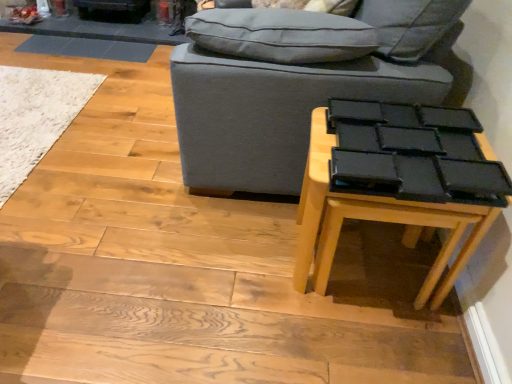
Question: From a real-world perspective, is white shaggy rug at lower left positioned under gray fabric studio couch at center based on gravity?

Choices:
 (A) no
 (B) yes

Answer: (B)

Question: Is white shaggy rug at lower left placed right next to gray fabric studio couch at center?

Choices:
 (A) no
 (B) yes

Answer: (A)

Question: Is white shaggy rug at lower left far away from gray fabric studio couch at center?

Choices:
 (A) no
 (B) yes

Answer: (B)

Question: From the image's perspective, would you say white shaggy rug at lower left is shown under gray fabric studio couch at center?

Choices:
 (A) yes
 (B) no

Answer: (A)

Question: From the image's perspective, is white shaggy rug at lower left above gray fabric studio couch at center?

Choices:
 (A) no
 (B) yes

Answer: (A)

Question: Is white shaggy rug at lower left closer to camera compared to gray fabric studio couch at center?

Choices:
 (A) no
 (B) yes

Answer: (A)

Question: Considering the relative sizes of white shaggy rug at lower left and black matte table at lower right in the image provided, is white shaggy rug at lower left wider than black matte table at lower right?

Choices:
 (A) yes
 (B) no

Answer: (A)

Question: Considering the relative positions of white shaggy rug at lower left and black matte table at lower right in the image provided, is white shaggy rug at lower left to the left of black matte table at lower right from the viewer's perspective?

Choices:
 (A) yes
 (B) no

Answer: (A)

Question: From the image's perspective, is white shaggy rug at lower left on black matte table at lower right?

Choices:
 (A) no
 (B) yes

Answer: (B)

Question: Is white shaggy rug at lower left located outside black matte table at lower right?

Choices:
 (A) no
 (B) yes

Answer: (B)

Question: From a real-world perspective, is white shaggy rug at lower left under black matte table at lower right?

Choices:
 (A) no
 (B) yes

Answer: (B)

Question: Is white shaggy rug at lower left beside black matte table at lower right?

Choices:
 (A) no
 (B) yes

Answer: (A)

Question: Is black matte table at lower right positioned with its back to white shaggy rug at lower left?

Choices:
 (A) yes
 (B) no

Answer: (B)